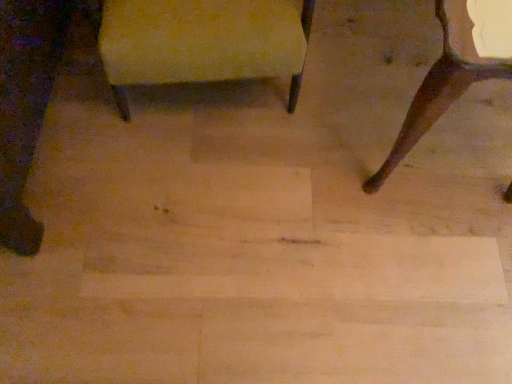
What do you see at coordinates (202, 42) in the screenshot?
I see `velvet yellow ottoman at upper left` at bounding box center [202, 42].

I want to click on velvet yellow ottoman at upper left, so click(202, 42).

Locate an element on the screen. velvet yellow ottoman at upper left is located at coordinates (202, 42).